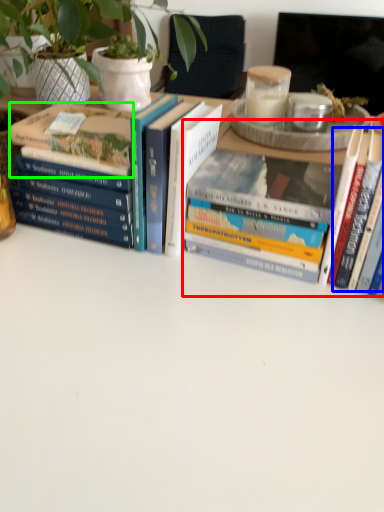
Question: Considering the real-world distances, which object is farthest from book (highlighted by a red box)? book (highlighted by a blue box) or book (highlighted by a green box)?

Choices:
 (A) book
 (B) book

Answer: (B)